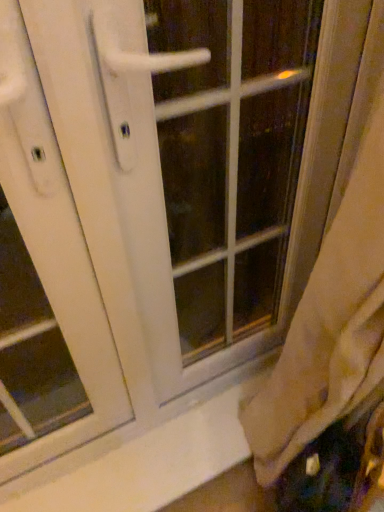
Question: Would you say white smooth window sill at lower center is a long distance from white plastic screen door at left?

Choices:
 (A) no
 (B) yes

Answer: (A)

Question: Is white smooth window sill at lower center bigger than white plastic screen door at left?

Choices:
 (A) no
 (B) yes

Answer: (A)

Question: Considering the relative sizes of white smooth window sill at lower center and white plastic screen door at left in the image provided, is white smooth window sill at lower center thinner than white plastic screen door at left?

Choices:
 (A) yes
 (B) no

Answer: (B)

Question: Is white smooth window sill at lower center placed right next to white plastic screen door at left?

Choices:
 (A) yes
 (B) no

Answer: (B)

Question: From the image's perspective, would you say white smooth window sill at lower center is positioned over white plastic screen door at left?

Choices:
 (A) no
 (B) yes

Answer: (A)

Question: Is white smooth window sill at lower center in front of or behind white glossy door handle at center in the image?

Choices:
 (A) front
 (B) behind

Answer: (B)

Question: Would you say white smooth window sill at lower center is inside or outside white glossy door handle at center?

Choices:
 (A) outside
 (B) inside

Answer: (A)

Question: From a real-world perspective, is white smooth window sill at lower center physically located above or below white glossy door handle at center?

Choices:
 (A) below
 (B) above

Answer: (A)

Question: Visually, is white smooth window sill at lower center positioned to the left or to the right of white glossy door handle at center?

Choices:
 (A) left
 (B) right

Answer: (A)

Question: Is white plastic screen door at left to the left or to the right of white glossy door handle at center in the image?

Choices:
 (A) right
 (B) left

Answer: (B)

Question: Based on their sizes in the image, would you say white plastic screen door at left is bigger or smaller than white glossy door handle at center?

Choices:
 (A) small
 (B) big

Answer: (A)

Question: Considering their positions, is white plastic screen door at left located in front of or behind white glossy door handle at center?

Choices:
 (A) behind
 (B) front

Answer: (B)

Question: From a real-world perspective, is white plastic screen door at left physically located above or below white glossy door handle at center?

Choices:
 (A) above
 (B) below

Answer: (A)

Question: Considering the positions of white glossy door handle at center and white smooth window sill at lower center in the image, is white glossy door handle at center wider or thinner than white smooth window sill at lower center?

Choices:
 (A) thin
 (B) wide

Answer: (A)

Question: Do you think white glossy door handle at center is within white smooth window sill at lower center, or outside of it?

Choices:
 (A) outside
 (B) inside

Answer: (A)